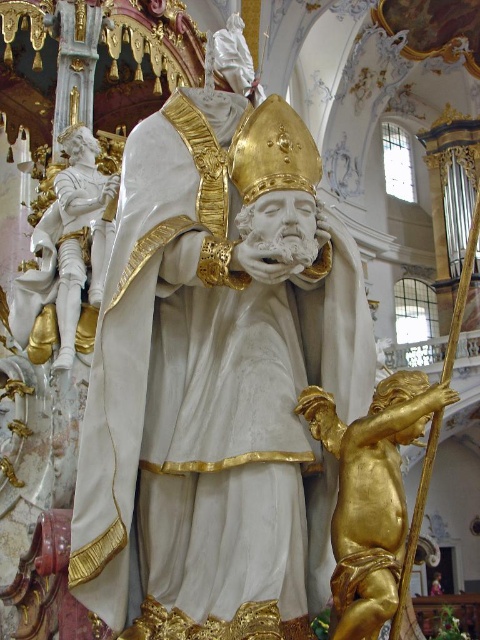
You are an art conservator assessing the placement of objects in the cathedral. You need to determine if the gold polished cherub at lower right is positioned above or below the white glossy statue at left. Based on the scene, what is the correct orientation?

The gold polished cherub at lower right is located below the white glossy statue at left, so the correct orientation is that the cherub is positioned below the statue.

You are an art student analyzing the composition of the cathedral interior. You notice two statues, the white marble statue at center and the white glossy statue at left. Which one is positioned higher in the visual hierarchy of the scene?

The white marble statue at center is positioned higher than the white glossy statue at left, making it the focal point in the visual hierarchy.